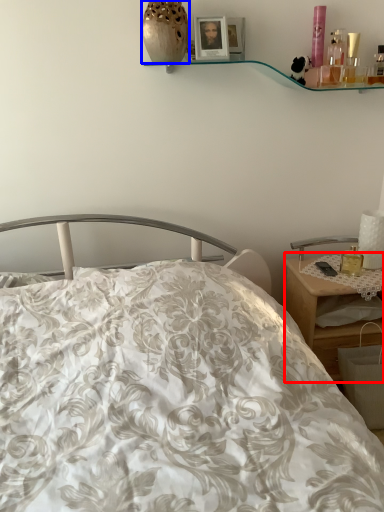
Question: Which object appears farthest to the camera in this image, desk (highlighted by a red box) or vase (highlighted by a blue box)?

Choices:
 (A) desk
 (B) vase

Answer: (A)